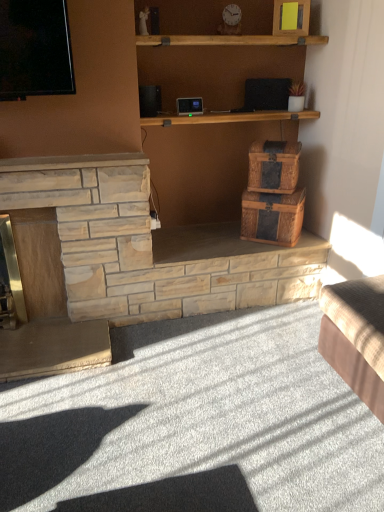
Question: Does woven brown crate at center-right lie in front of natural stone fireplace at left?

Choices:
 (A) yes
 (B) no

Answer: (B)

Question: Could you tell me if woven brown crate at center-right is facing natural stone fireplace at left?

Choices:
 (A) no
 (B) yes

Answer: (A)

Question: Considering the relative positions of woven brown crate at center-right and natural stone fireplace at left in the image provided, is woven brown crate at center-right to the right of natural stone fireplace at left from the viewer's perspective?

Choices:
 (A) yes
 (B) no

Answer: (A)

Question: Considering the relative sizes of woven brown crate at center-right and natural stone fireplace at left in the image provided, is woven brown crate at center-right taller than natural stone fireplace at left?

Choices:
 (A) no
 (B) yes

Answer: (A)

Question: From a real-world perspective, is woven brown crate at center-right physically above natural stone fireplace at left?

Choices:
 (A) yes
 (B) no

Answer: (A)

Question: From a real-world perspective, is woven wood chest at center above or below natural stone fireplace at left?

Choices:
 (A) below
 (B) above

Answer: (B)

Question: Considering the positions of woven wood chest at center and natural stone fireplace at left in the image, is woven wood chest at center bigger or smaller than natural stone fireplace at left?

Choices:
 (A) small
 (B) big

Answer: (A)

Question: Is woven wood chest at center in front of or behind natural stone fireplace at left in the image?

Choices:
 (A) behind
 (B) front

Answer: (A)

Question: Does point (273, 210) appear closer or farther from the camera than point (36, 343)?

Choices:
 (A) closer
 (B) farther

Answer: (B)

Question: Based on their sizes in the image, would you say woven brown crate at center-right is bigger or smaller than woven wood chest at center?

Choices:
 (A) big
 (B) small

Answer: (B)

Question: Looking at their shapes, would you say woven brown crate at center-right is wider or thinner than woven wood chest at center?

Choices:
 (A) thin
 (B) wide

Answer: (A)

Question: Does point (266, 155) appear closer or farther from the camera than point (253, 230)?

Choices:
 (A) closer
 (B) farther

Answer: (A)

Question: From the image's perspective, is woven brown crate at center-right above or below woven wood chest at center?

Choices:
 (A) below
 (B) above

Answer: (B)

Question: From a real-world perspective, is woven brown crate at center-right physically located above or below natural stone fireplace at left?

Choices:
 (A) below
 (B) above

Answer: (B)

Question: In terms of height, does woven brown crate at center-right look taller or shorter compared to natural stone fireplace at left?

Choices:
 (A) short
 (B) tall

Answer: (A)